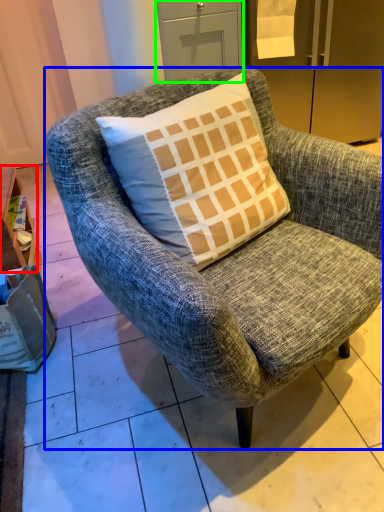
Question: Which object is positioned farthest from table (highlighted by a red box)? Select from chair (highlighted by a blue box) and drawer (highlighted by a green box).

Choices:
 (A) chair
 (B) drawer

Answer: (B)